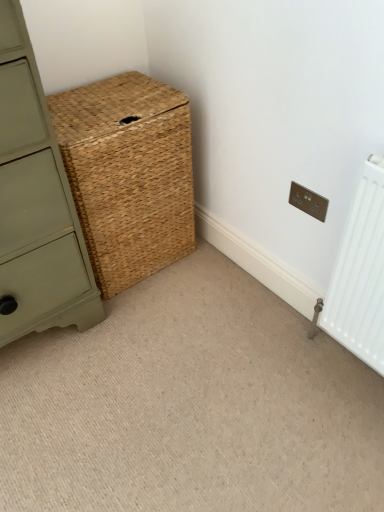
Where is `natural woven basket at center`? This screenshot has width=384, height=512. natural woven basket at center is located at coordinates (128, 174).

Measure the distance between point (x=152, y=261) and camera.

They are 1.77 meters apart.

The width and height of the screenshot is (384, 512). Describe the element at coordinates (190, 405) in the screenshot. I see `natural woven basket at center` at that location.

Image resolution: width=384 pixels, height=512 pixels. In order to click on matte silver electric outlet at upper right in this screenshot , I will do `click(308, 201)`.

Locate an element on the screen. matte green chest of drawers at center-left is located at coordinates (36, 204).

Is natural woven basket at center oriented towards matte green chest of drawers at center-left?

No, natural woven basket at center is not facing towards matte green chest of drawers at center-left.

Does point (138, 364) come behind point (30, 82)?

Yes, it is.

Based on the photo, from a real-world perspective, which is physically below, natural woven basket at center or matte green chest of drawers at center-left?

natural woven basket at center is physically lower.

Relative to matte green chest of drawers at center-left, is natural woven basket at center in front or behind?

Clearly, natural woven basket at center is behind matte green chest of drawers at center-left.

From the picture: Can you tell me how much matte silver electric outlet at upper right and natural woven basket at center differ in facing direction?

The facing directions of matte silver electric outlet at upper right and natural woven basket at center are 89 degrees apart.

From a real-world perspective, relative to natural woven basket at center, is matte silver electric outlet at upper right vertically above or below?

matte silver electric outlet at upper right is above natural woven basket at center.

Looking at this image, considering the sizes of matte silver electric outlet at upper right and natural woven basket at center in the image, is matte silver electric outlet at upper right wider or thinner than natural woven basket at center?

Clearly, matte silver electric outlet at upper right has less width compared to natural woven basket at center.

Could you tell me if matte silver electric outlet at upper right is facing natural woven basket at center?

No, matte silver electric outlet at upper right is not aimed at natural woven basket at center.

What's the angular difference between matte silver electric outlet at upper right and natural woven basket at center's facing directions?

The facing directions of matte silver electric outlet at upper right and natural woven basket at center are 89.2 degrees apart.

From the image's perspective, who appears lower, matte silver electric outlet at upper right or natural woven basket at center?

natural woven basket at center, from the image's perspective.

Is matte silver electric outlet at upper right to the right of natural woven basket at center from the viewer's perspective?

Yes.

Based on the photo, considering the sizes of objects matte green chest of drawers at center-left and natural woven basket at center in the image provided, who is smaller, matte green chest of drawers at center-left or natural woven basket at center?

natural woven basket at center is smaller.

From the picture: Considering the sizes of objects matte green chest of drawers at center-left and natural woven basket at center in the image provided, who is shorter, matte green chest of drawers at center-left or natural woven basket at center?

With less height is natural woven basket at center.

Is matte green chest of drawers at center-left directly adjacent to natural woven basket at center?

No, matte green chest of drawers at center-left is not making contact with natural woven basket at center.

Which is behind, matte green chest of drawers at center-left or natural woven basket at center?

natural woven basket at center.

Does natural woven basket at center turn towards matte silver electric outlet at upper right?

Yes, natural woven basket at center faces towards matte silver electric outlet at upper right.

Is natural woven basket at center closer to the viewer compared to matte silver electric outlet at upper right?

Result: Yes, the depth of natural woven basket at center is less than that of matte silver electric outlet at upper right.

Can you confirm if natural woven basket at center is bigger than matte silver electric outlet at upper right?

Yes.

Between natural woven basket at center and matte silver electric outlet at upper right, which one has less height?

With less height is matte silver electric outlet at upper right.

Is matte silver electric outlet at upper right facing towards matte green chest of drawers at center-left?

No, matte silver electric outlet at upper right is not facing towards matte green chest of drawers at center-left.

Between matte silver electric outlet at upper right and matte green chest of drawers at center-left, which one has less height?

With less height is matte silver electric outlet at upper right.

Does matte silver electric outlet at upper right appear on the right side of matte green chest of drawers at center-left?

Correct, you'll find matte silver electric outlet at upper right to the right of matte green chest of drawers at center-left.

From a real-world perspective, is matte silver electric outlet at upper right over matte green chest of drawers at center-left?

No.

Can you confirm if natural woven basket at center is shorter than natural woven basket at center?

In fact, natural woven basket at center may be taller than natural woven basket at center.

Based on their positions, is natural woven basket at center located to the left or right of natural woven basket at center?

In the image, natural woven basket at center appears on the left side of natural woven basket at center.

From the image's perspective, does natural woven basket at center appear higher than natural woven basket at center?

Yes, from the image's perspective, natural woven basket at center is on top of natural woven basket at center.

From a real-world perspective, is natural woven basket at center below natural woven basket at center?

Actually, natural woven basket at center is physically above natural woven basket at center in the real world.

You are a GUI agent. You are given a task and a screenshot of the screen. Output one action in this format:
    pyautogui.click(x=<x>, y=<y>)
    Task: Click on the chest of drawers in front of the natural woven basket at center
    
    Given the screenshot: What is the action you would take?
    pos(36,204)

Where is `basket above the matte silver electric outlet at upper right (from the image's perspective)`? basket above the matte silver electric outlet at upper right (from the image's perspective) is located at coordinates (128, 174).

When comparing their distances from matte silver electric outlet at upper right, does matte green chest of drawers at center-left or natural woven basket at center seem closer?

natural woven basket at center.

Which object lies nearer to the anchor point matte silver electric outlet at upper right, matte green chest of drawers at center-left or natural woven basket at center?

natural woven basket at center.

When comparing their distances from matte green chest of drawers at center-left, does natural woven basket at center or matte silver electric outlet at upper right seem closer?

natural woven basket at center is positioned closer to the anchor matte green chest of drawers at center-left.

Estimate the real-world distances between objects in this image. Which object is closer to natural woven basket at center, natural woven basket at center or matte green chest of drawers at center-left?

The object closer to natural woven basket at center is matte green chest of drawers at center-left.

When comparing their distances from natural woven basket at center, does matte green chest of drawers at center-left or matte silver electric outlet at upper right seem further?

Based on the image, matte silver electric outlet at upper right appears to be further to natural woven basket at center.

Estimate the real-world distances between objects in this image. Which object is further from natural woven basket at center, matte green chest of drawers at center-left or natural woven basket at center?

natural woven basket at center is further to natural woven basket at center.

From the picture: Estimate the real-world distances between objects in this image. Which object is closer to matte silver electric outlet at upper right, natural woven basket at center or natural woven basket at center?

natural woven basket at center is closer to matte silver electric outlet at upper right.

Which object lies nearer to the anchor point natural woven basket at center, natural woven basket at center or matte silver electric outlet at upper right?

natural woven basket at center is positioned closer to the anchor natural woven basket at center.

Locate an element on the screen. basket between matte green chest of drawers at center-left and matte silver electric outlet at upper right in the horizontal direction is located at coordinates (128, 174).

Identify the location of plain situated between matte green chest of drawers at center-left and matte silver electric outlet at upper right from left to right. This screenshot has height=512, width=384. (190, 405).

Where is `electric outlet between natural woven basket at center and natural woven basket at center in the vertical direction`? This screenshot has width=384, height=512. electric outlet between natural woven basket at center and natural woven basket at center in the vertical direction is located at coordinates (308, 201).

You are a GUI agent. You are given a task and a screenshot of the screen. Output one action in this format:
    pyautogui.click(x=<x>, y=<y>)
    Task: Click on the chest of drawers between natural woven basket at center and natural woven basket at center from top to bottom
    This screenshot has width=384, height=512.
    Given the screenshot: What is the action you would take?
    pyautogui.click(x=36, y=204)